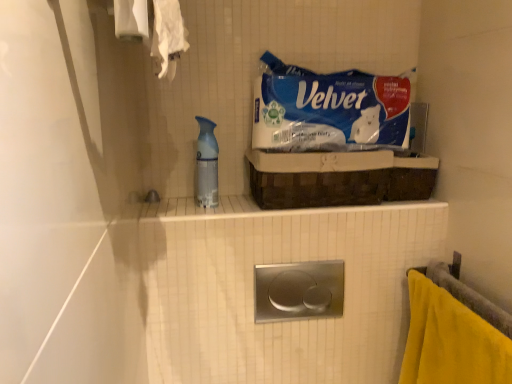
Question: Is yellow fabric towel at lower right in front of or behind blue paper towel at upper center in the image?

Choices:
 (A) behind
 (B) front

Answer: (B)

Question: From a real-world perspective, is yellow fabric towel at lower right physically located above or below blue paper towel at upper center?

Choices:
 (A) above
 (B) below

Answer: (B)

Question: Which is farther from the brown woven basket at upper center?

Choices:
 (A) translucent plastic spray bottle at center
 (B) blue paper towel at upper center
 (C) polished stainless steel flush plate at center
 (D) yellow fabric towel at lower right

Answer: (D)

Question: Which object is positioned farthest from the yellow fabric towel at lower right?

Choices:
 (A) translucent plastic spray bottle at center
 (B) blue paper towel at upper center
 (C) polished stainless steel flush plate at center
 (D) brown woven basket at upper center

Answer: (A)